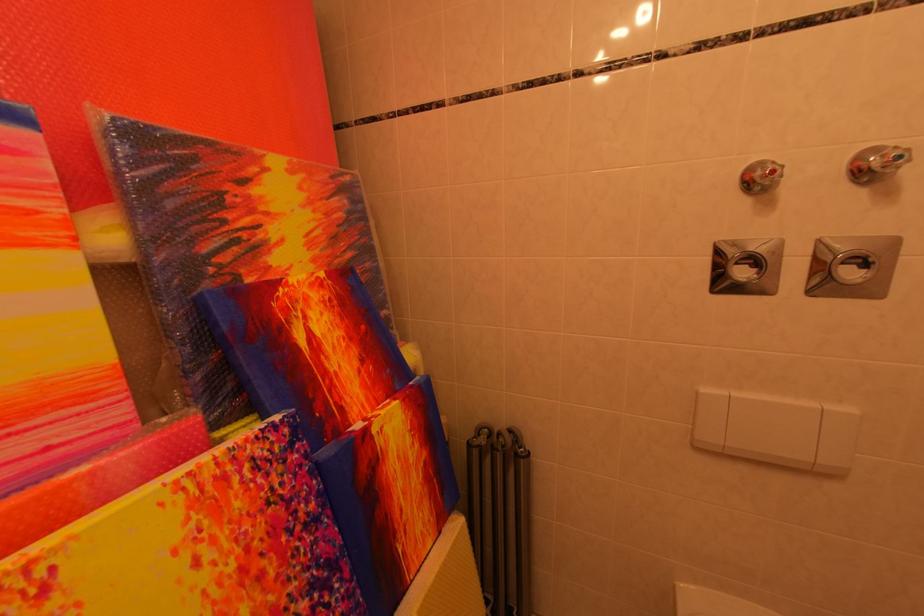
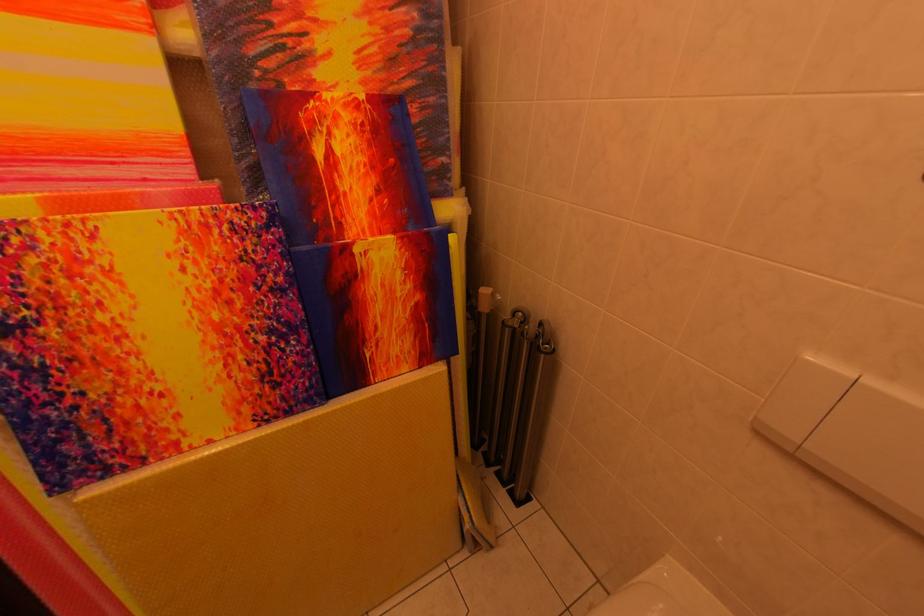
The images are taken continuously from a first-person perspective. In which direction is your viewpoint rotating?

The rotation direction of the camera is left-down.